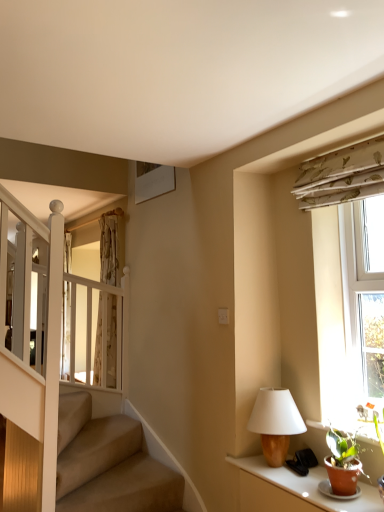
Question: Considering the relative positions of white textured window at right and matte brown table at lower right in the image provided, is white textured window at right in front of matte brown table at lower right?

Choices:
 (A) yes
 (B) no

Answer: (B)

Question: From a real-world perspective, does white textured window at right sit lower than matte brown table at lower right?

Choices:
 (A) yes
 (B) no

Answer: (B)

Question: Is white textured window at right in contact with matte brown table at lower right?

Choices:
 (A) yes
 (B) no

Answer: (B)

Question: From a real-world perspective, is white textured window at right over matte brown table at lower right?

Choices:
 (A) no
 (B) yes

Answer: (B)

Question: Can we say white textured window at right lies outside matte brown table at lower right?

Choices:
 (A) no
 (B) yes

Answer: (B)

Question: Can you confirm if white textured window at right is shorter than matte brown table at lower right?

Choices:
 (A) no
 (B) yes

Answer: (A)

Question: Is wooden table lamp at right completely or partially inside translucent fabric curtain at upper left?

Choices:
 (A) no
 (B) yes

Answer: (A)

Question: Is translucent fabric curtain at upper left positioned before wooden table lamp at right?

Choices:
 (A) yes
 (B) no

Answer: (B)

Question: Is translucent fabric curtain at upper left facing away from wooden table lamp at right?

Choices:
 (A) no
 (B) yes

Answer: (A)

Question: Considering the relative sizes of translucent fabric curtain at upper left and wooden table lamp at right in the image provided, is translucent fabric curtain at upper left taller than wooden table lamp at right?

Choices:
 (A) no
 (B) yes

Answer: (B)

Question: From the image's perspective, would you say translucent fabric curtain at upper left is positioned over wooden table lamp at right?

Choices:
 (A) yes
 (B) no

Answer: (A)

Question: Does translucent fabric curtain at upper left have a lesser width compared to wooden table lamp at right?

Choices:
 (A) yes
 (B) no

Answer: (A)

Question: Considering the relative sizes of translucent fabric curtain at upper left and matte brown table at lower right in the image provided, is translucent fabric curtain at upper left wider than matte brown table at lower right?

Choices:
 (A) yes
 (B) no

Answer: (B)